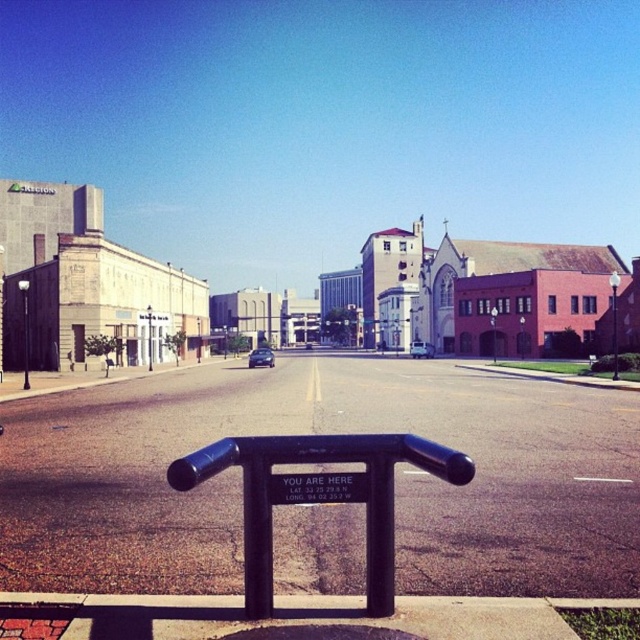
The image size is (640, 640). Find the location of `brushed metal pole at center`. brushed metal pole at center is located at coordinates (148, 337).

Is brushed metal pole at center wider than shiny black sedan at center?

In fact, brushed metal pole at center might be narrower than shiny black sedan at center.

Does point (150, 353) come behind point (308, 349)?

No, (150, 353) is in front of (308, 349).

Where is `brushed metal pole at center`? This screenshot has height=640, width=640. brushed metal pole at center is located at coordinates (148, 337).

Is point (426, 342) farther from camera compared to point (308, 348)?

No, it is in front of (308, 348).

Does silver metallic sedan at center have a greater width compared to shiny black sedan at center?

Correct, the width of silver metallic sedan at center exceeds that of shiny black sedan at center.

This screenshot has height=640, width=640. What do you see at coordinates (420, 349) in the screenshot? I see `silver metallic sedan at center` at bounding box center [420, 349].

Find the location of a particular element. The image size is (640, 640). silver metallic sedan at center is located at coordinates (420, 349).

Can you confirm if silver metallic sedan at center is taller than brushed metal pole at center?

No.

Does silver metallic sedan at center have a smaller size compared to brushed metal pole at center?

Actually, silver metallic sedan at center might be larger than brushed metal pole at center.

Describe the element at coordinates (420, 349) in the screenshot. This screenshot has width=640, height=640. I see `silver metallic sedan at center` at that location.

Locate an element on the screen. silver metallic sedan at center is located at coordinates (420, 349).